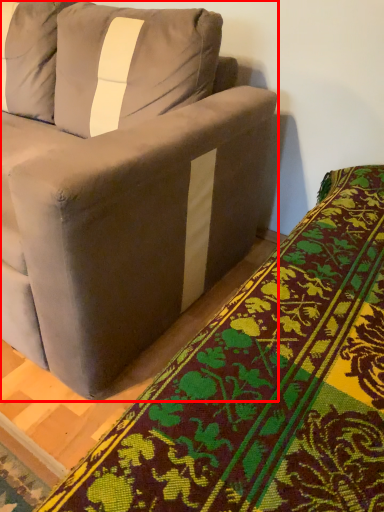
Question: From the image's perspective, what is the correct spatial positioning of studio couch (annotated by the red box) in reference to blanket?

Choices:
 (A) above
 (B) below

Answer: (A)